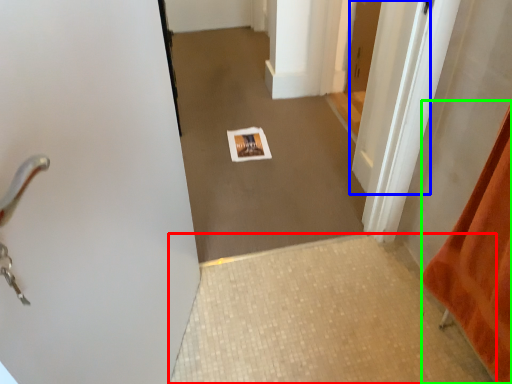
Question: Estimate the real-world distances between objects in this image. Which object is closer to tile (highlighted by a red box), door (highlighted by a blue box) or blanket (highlighted by a green box)?

Choices:
 (A) door
 (B) blanket

Answer: (B)